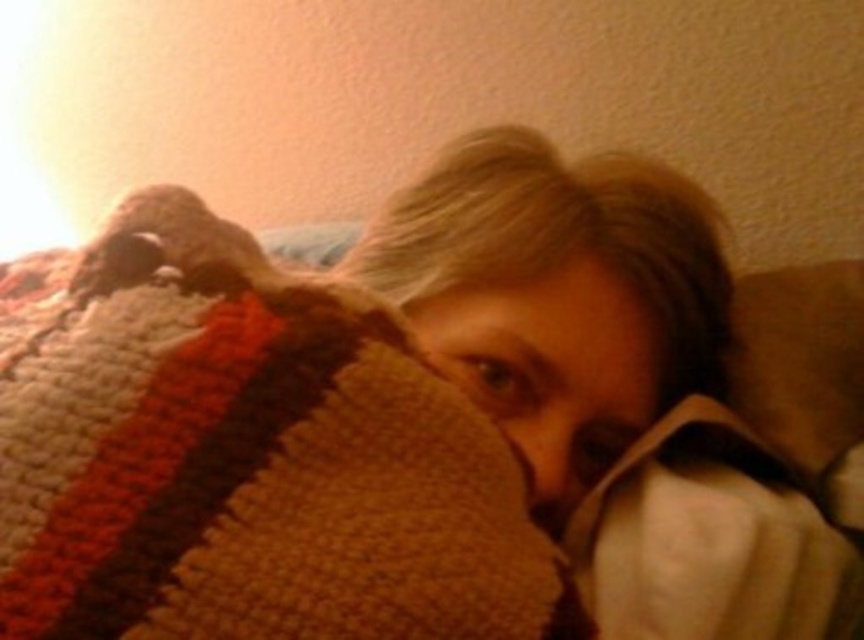
Which is behind, point (162, 557) or point (433, 344)?

Point (433, 344)

Can you confirm if knitted wool blanket at center is positioned above smooth skin face at center?

Correct, knitted wool blanket at center is located above smooth skin face at center.

Between point (134, 211) and point (516, 432), which one is positioned behind?

The point (516, 432) is behind.

What are the coordinates of `knitted wool blanket at center` in the screenshot? It's located at (248, 458).